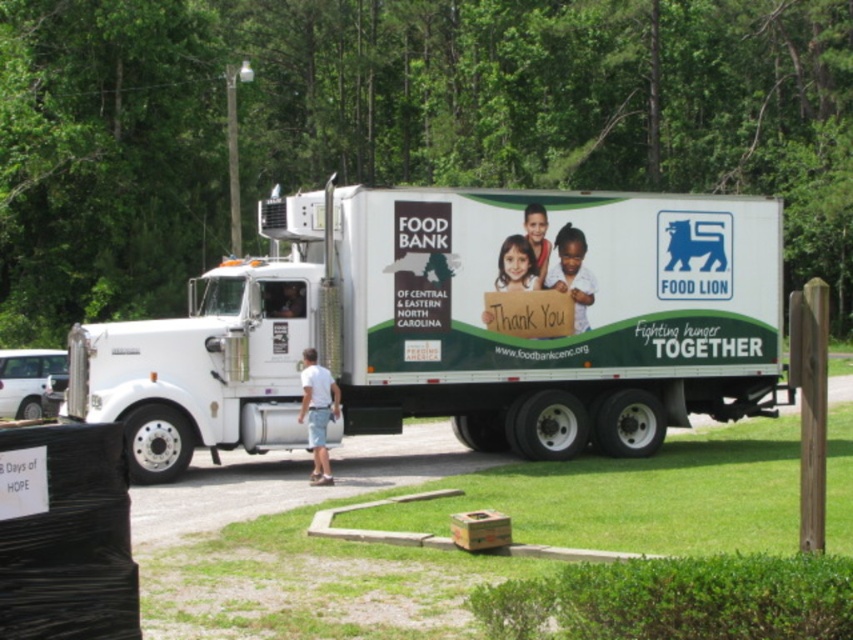
Question: Does white matte truck at center appear under black plastic sign at lower left?

Choices:
 (A) yes
 (B) no

Answer: (B)

Question: Is white matte truck at center to the left of black plastic sign at lower left from the viewer's perspective?

Choices:
 (A) no
 (B) yes

Answer: (B)

Question: Which point is closer to the camera taking this photo?

Choices:
 (A) (10, 509)
 (B) (548, 384)

Answer: (A)

Question: Does white matte truck at center appear on the right side of black plastic sign at lower left?

Choices:
 (A) yes
 (B) no

Answer: (B)

Question: Which point is closer to the camera taking this photo?

Choices:
 (A) (187, 355)
 (B) (65, 577)

Answer: (B)